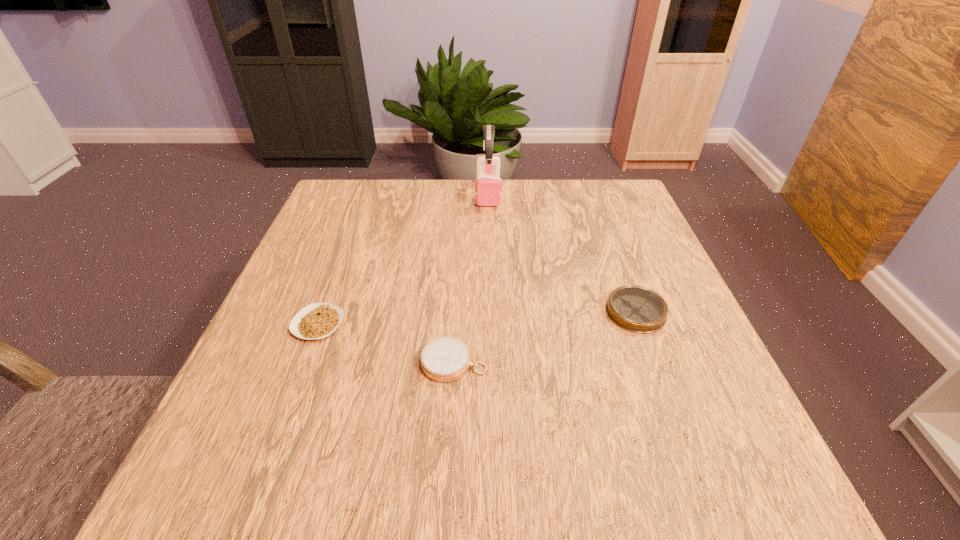
This screenshot has width=960, height=540. Find the location of `object at the far edge`. object at the far edge is located at coordinates (488, 187).

Identify the location of object at the left edge. (318, 320).

At what (x,y) coordinates should I click in order to perform the action: click on object situated at the right edge. Please return your answer as a coordinate pair (x, y). Image resolution: width=960 pixels, height=540 pixels. Looking at the image, I should click on (637, 309).

The image size is (960, 540). What are the coordinates of `free space at the far edge of the desktop` in the screenshot? It's located at (539, 224).

Locate an element on the screen. This screenshot has width=960, height=540. free point at the near edge is located at coordinates (347, 505).

Find the location of a particular element. The image size is (960, 540). vacant space at the left edge of the desktop is located at coordinates (329, 236).

This screenshot has width=960, height=540. In order to click on free region at the right edge of the desktop in this screenshot , I will do `click(663, 262)`.

Locate an element on the screen. This screenshot has width=960, height=540. blank area at the far left corner is located at coordinates (349, 202).

In the image, there is a desktop. Identify the location of vacant space at the near left corner. (247, 470).

In the image, there is a desktop. Where is `vacant space at the far right corner`? Image resolution: width=960 pixels, height=540 pixels. vacant space at the far right corner is located at coordinates (587, 218).